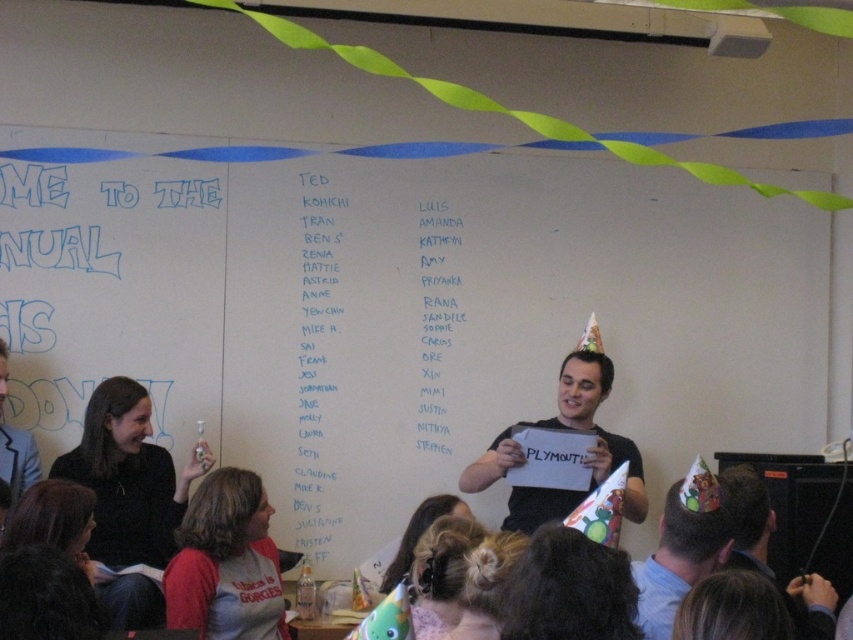
Can you confirm if white paper list at center is bigger than matte black party hat at lower right?

No.

Who is shorter, white paper list at center or matte black party hat at lower right?

matte black party hat at lower right is shorter.

Between point (338, 301) and point (769, 532), which one is positioned in front?

Point (769, 532) is in front.

Identify the location of white paper list at center. This screenshot has height=640, width=853. (316, 360).

Which is more to the left, matte red shirt at lower left or white matte paper at center?

Positioned to the left is matte red shirt at lower left.

Is matte red shirt at lower left bigger than white matte paper at center?

Incorrect, matte red shirt at lower left is not larger than white matte paper at center.

What are the coordinates of `matte red shirt at lower left` in the screenshot? It's located at (225, 563).

How much distance is there between white paper hat at center and matte black party hat at lower right?

white paper hat at center and matte black party hat at lower right are 8.94 inches apart from each other.

Measure the distance between point (685,512) and camera.

2.43 meters

Is point (717, 502) in front of point (730, 508)?

Yes, point (717, 502) is in front of point (730, 508).

Find the location of `white paper hat at center`. white paper hat at center is located at coordinates (682, 554).